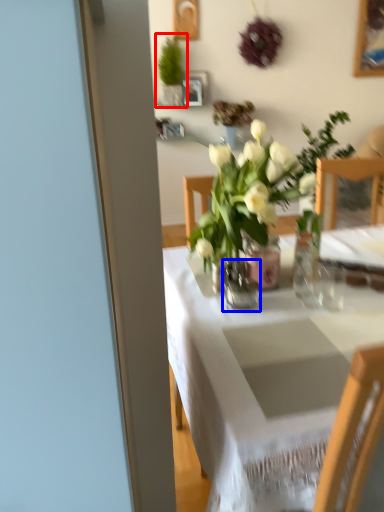
Question: Which of the following is the farthest to the observer, houseplant (highlighted by a red box) or vase (highlighted by a blue box)?

Choices:
 (A) houseplant
 (B) vase

Answer: (A)